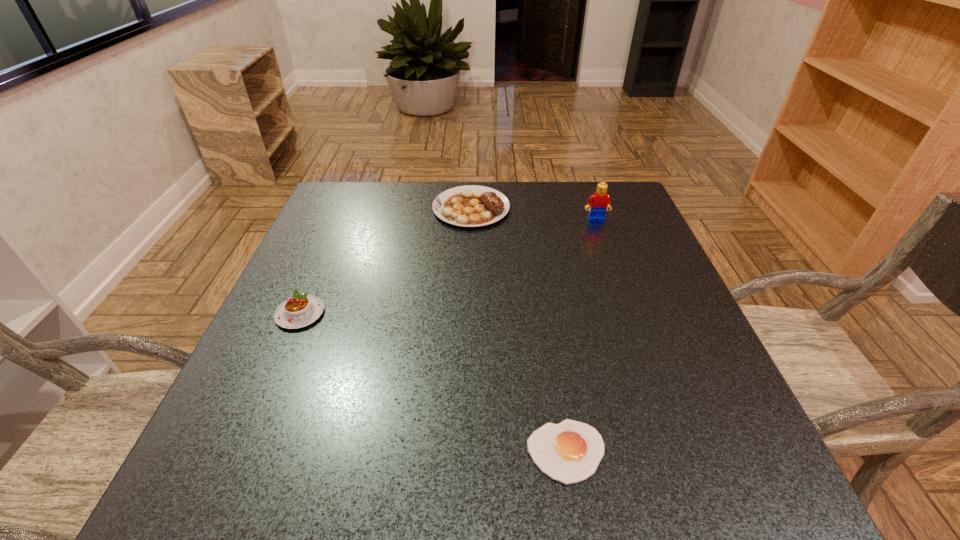
Where is `free space that is in between the shortest object and the steak`? This screenshot has height=540, width=960. free space that is in between the shortest object and the steak is located at coordinates (518, 330).

Find the location of a particular element. The height and width of the screenshot is (540, 960). free space between the steak and the egg yolk is located at coordinates (518, 330).

The height and width of the screenshot is (540, 960). What are the coordinates of `free point between the steak and the leftmost object` in the screenshot? It's located at (386, 261).

Find the location of a particular element. The width and height of the screenshot is (960, 540). free space between the nearest object and the second nearest object is located at coordinates (433, 382).

Where is `object that can be found as the third closest to the egg yolk`? Image resolution: width=960 pixels, height=540 pixels. object that can be found as the third closest to the egg yolk is located at coordinates (600, 201).

Find the location of a particular element. This screenshot has width=960, height=540. object that is the closest to the pudding is located at coordinates (469, 206).

Where is `vacant space that satisfies the following two spatial constraints: 1. on the back side of the steak; 2. on the left side of the pudding`? vacant space that satisfies the following two spatial constraints: 1. on the back side of the steak; 2. on the left side of the pudding is located at coordinates (346, 208).